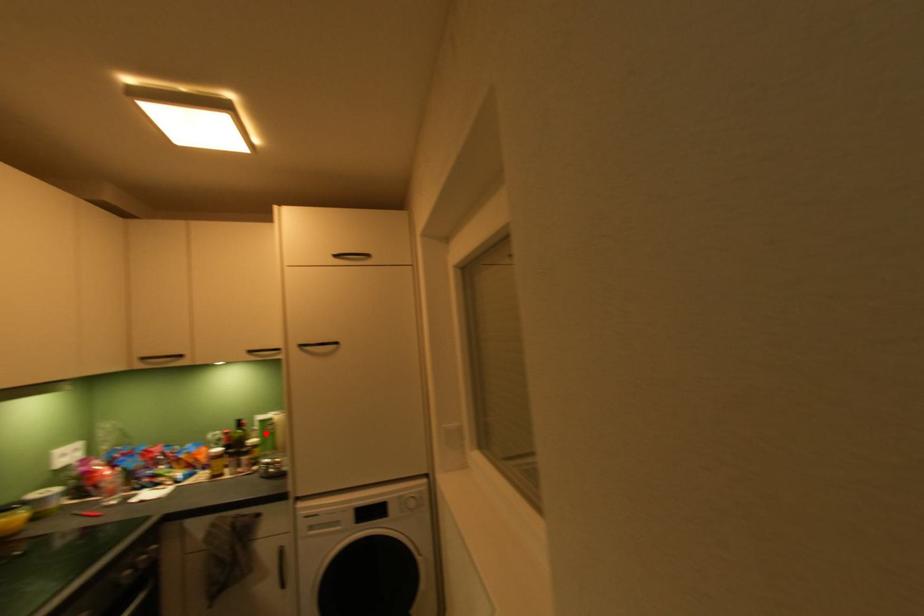
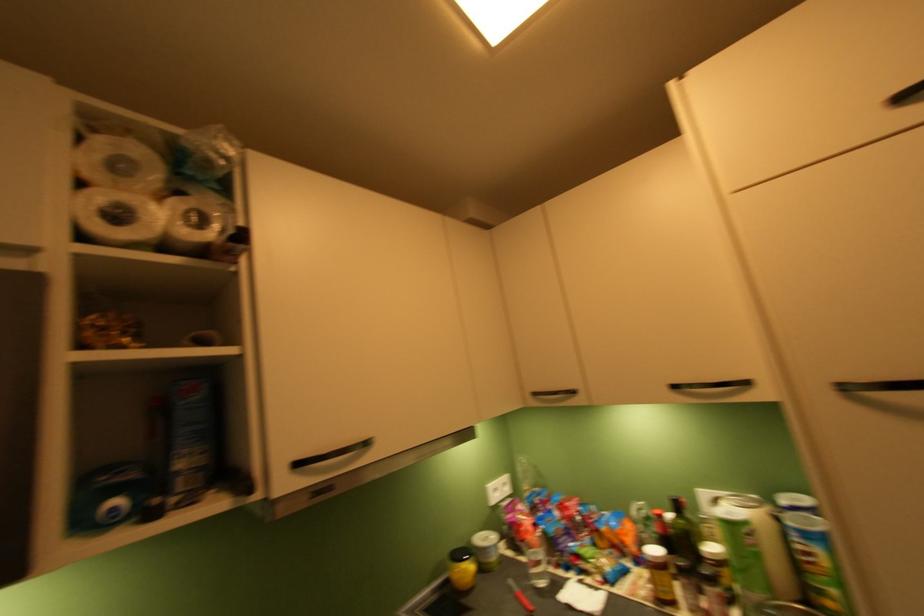
Question: I am providing you with two images of the same scene from different viewpoints. A red point is marked on the first image. Can you still see the location of the red point in image 2?

Choices:
 (A) Yes
 (B) No

Answer: (A)